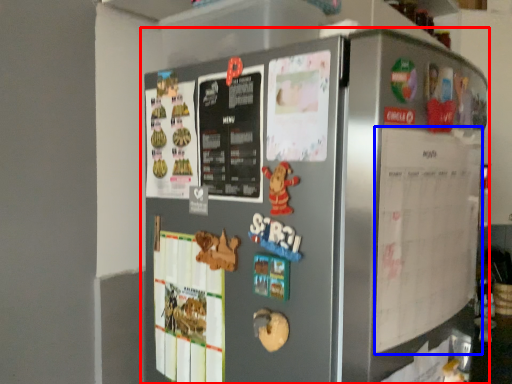
Question: Which of the following is the closest to the observer, refrigerator (highlighted by a red box) or menu (highlighted by a blue box)?

Choices:
 (A) refrigerator
 (B) menu

Answer: (A)